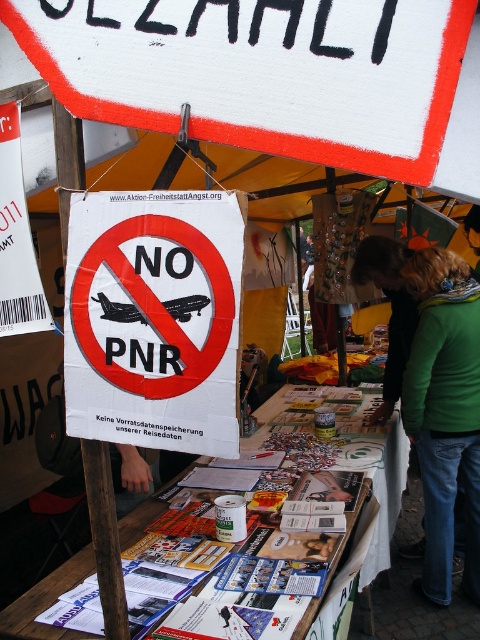
Who is positioned more to the left, yellow fabric canopy at upper center or green fabric jacket at lower right?

yellow fabric canopy at upper center

Is yellow fabric canopy at upper center further to the viewer compared to green fabric jacket at lower right?

No, it is in front of green fabric jacket at lower right.

Which is behind, point (317, 148) or point (434, 388)?

The point (434, 388) is behind.

Identify the location of yellow fabric canopy at upper center. (262, 72).

Can you confirm if white paper sign at center is positioned to the right of green fabric jacket at lower right?

In fact, white paper sign at center is to the left of green fabric jacket at lower right.

Between white paper sign at center and green fabric jacket at lower right, which one is positioned lower?

green fabric jacket at lower right is lower down.

Is point (213, 429) more distant than point (471, 276)?

No, it is not.

Find the location of a particular element. The width and height of the screenshot is (480, 640). white paper sign at center is located at coordinates point(154,317).

Who is taller, yellow fabric canopy at upper center or white paper sign at center?

With more height is white paper sign at center.

Can you confirm if yellow fabric canopy at upper center is shorter than white paper sign at center?

Indeed, yellow fabric canopy at upper center has a lesser height compared to white paper sign at center.

Which is behind, point (205, 24) or point (231, 385)?

The point (231, 385) is behind.

Find the location of `yellow fabric canopy at upper center`. yellow fabric canopy at upper center is located at coordinates (262, 72).